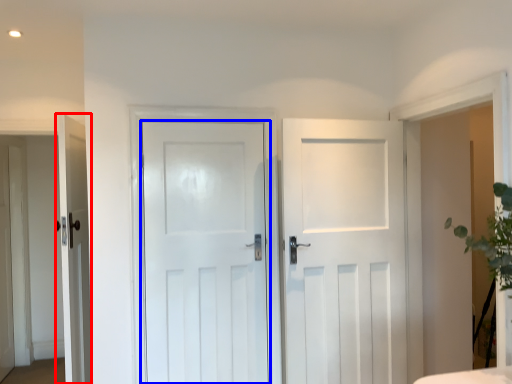
Question: Which object is closer to the camera taking this photo, door (highlighted by a red box) or door (highlighted by a blue box)?

Choices:
 (A) door
 (B) door

Answer: (A)